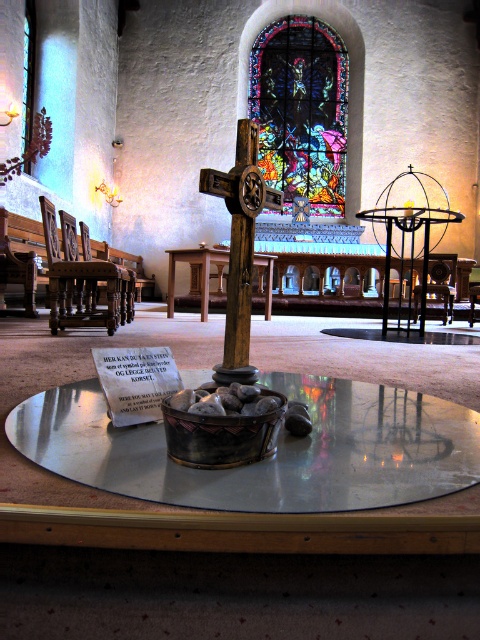
Question: Which point is closer to the camera taking this photo?

Choices:
 (A) (441, 257)
 (B) (268, 200)
 (C) (323, 64)

Answer: (B)

Question: Is wooden polished bench at left wider than wooden chair at center?

Choices:
 (A) yes
 (B) no

Answer: (B)

Question: Estimate the real-world distances between objects in this image. Which object is closer to the wooden cross at center?

Choices:
 (A) wooden polished bench at left
 (B) stained glass window at upper center
 (C) dark brown wood chair at left
 (D) wooden chair at center

Answer: (C)

Question: Does wooden cross at center appear on the left side of wooden chair at center?

Choices:
 (A) no
 (B) yes

Answer: (B)

Question: Is transparent glass table at center smaller than stained glass window at upper center?

Choices:
 (A) yes
 (B) no

Answer: (A)

Question: Which of the following is the closest to the observer?

Choices:
 (A) wooden cross at center
 (B) dark brown wood chair at left
 (C) transparent glass table at center
 (D) wooden chair at center

Answer: (C)